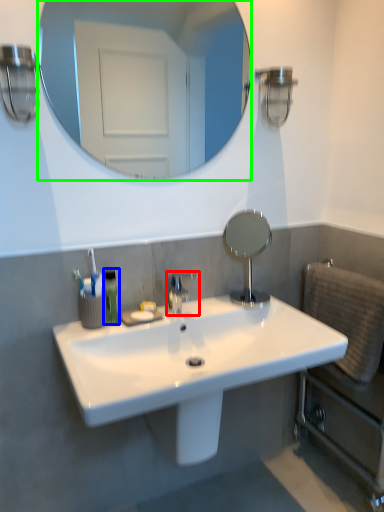
Question: Based on their relative distances, which object is farther from tap (highlighted by a red box)? Choose from mouthwash (highlighted by a blue box) and mirror (highlighted by a green box).

Choices:
 (A) mouthwash
 (B) mirror

Answer: (B)